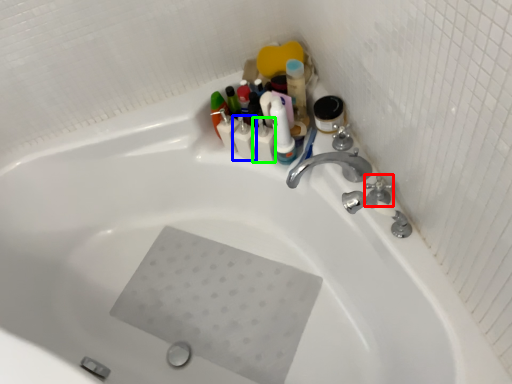
Question: Considering the real-world distances, which object is closest to plumbing fixture (highlighted by a red box)? toiletry (highlighted by a blue box) or toiletry (highlighted by a green box).

Choices:
 (A) toiletry
 (B) toiletry

Answer: (B)